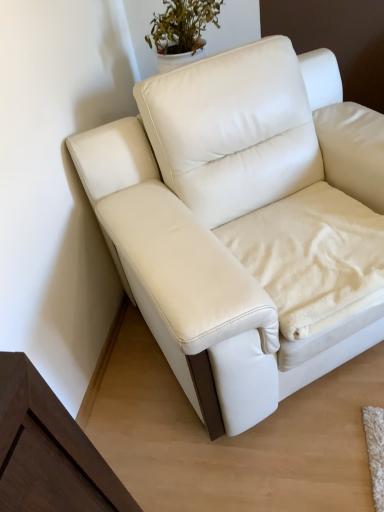
Question: Is white leather couch at center positioned far away from white fleece blanket at lower right?

Choices:
 (A) no
 (B) yes

Answer: (A)

Question: Can you confirm if white leather couch at center is positioned to the left of white fleece blanket at lower right?

Choices:
 (A) no
 (B) yes

Answer: (B)

Question: Can you confirm if white leather couch at center is taller than white fleece blanket at lower right?

Choices:
 (A) no
 (B) yes

Answer: (B)

Question: Considering the relative sizes of white leather couch at center and white fleece blanket at lower right in the image provided, is white leather couch at center shorter than white fleece blanket at lower right?

Choices:
 (A) no
 (B) yes

Answer: (A)

Question: Considering the relative sizes of white leather couch at center and white fleece blanket at lower right in the image provided, is white leather couch at center bigger than white fleece blanket at lower right?

Choices:
 (A) yes
 (B) no

Answer: (A)

Question: Is the depth of white leather couch at center less than that of white fleece blanket at lower right?

Choices:
 (A) no
 (B) yes

Answer: (B)

Question: Can you confirm if white fleece blanket at lower right is taller than white leather couch at center?

Choices:
 (A) no
 (B) yes

Answer: (A)

Question: From the image's perspective, is white fleece blanket at lower right beneath white leather couch at center?

Choices:
 (A) no
 (B) yes

Answer: (B)

Question: Is white fleece blanket at lower right shorter than white leather couch at center?

Choices:
 (A) no
 (B) yes

Answer: (B)

Question: Does white fleece blanket at lower right lie in front of white leather couch at center?

Choices:
 (A) yes
 (B) no

Answer: (B)

Question: Are white fleece blanket at lower right and white leather couch at center far apart?

Choices:
 (A) no
 (B) yes

Answer: (A)

Question: Can you confirm if white fleece blanket at lower right is thinner than white leather couch at center?

Choices:
 (A) yes
 (B) no

Answer: (A)

Question: Is white fleece blanket at lower right in front of or behind white leather couch at center in the image?

Choices:
 (A) behind
 (B) front

Answer: (A)